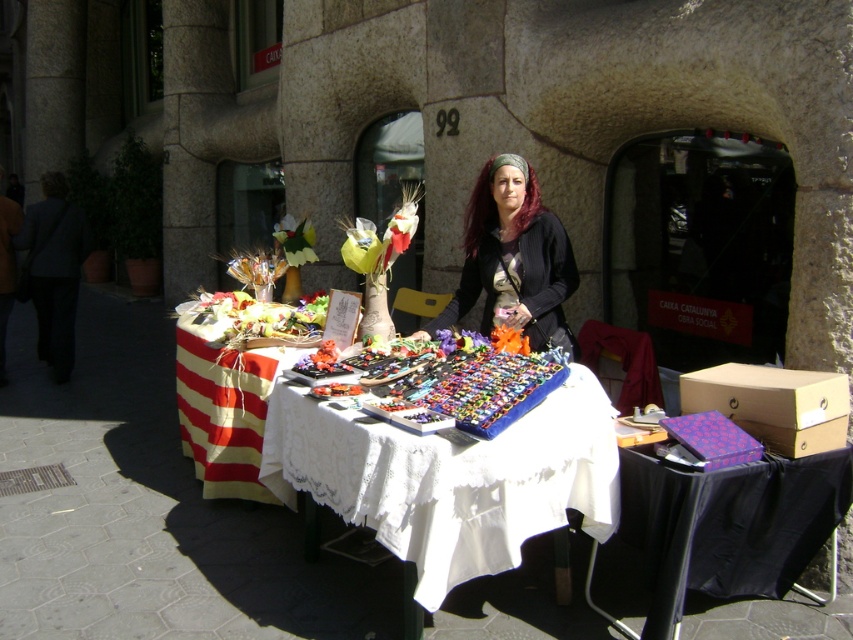
Is point (790, 486) behind point (544, 332)?

No, (790, 486) is closer to viewer.

Does purple fabric box at lower right have a greater height compared to matte black jacket at center?

In fact, purple fabric box at lower right may be shorter than matte black jacket at center.

Is point (674, 492) closer to viewer compared to point (508, 324)?

Yes, point (674, 492) is closer to viewer.

You are a GUI agent. You are given a task and a screenshot of the screen. Output one action in this format:
    pyautogui.click(x=<x>, y=<y>)
    Task: Click on the purple fabric box at lower right
    
    Given the screenshot: What is the action you would take?
    pyautogui.click(x=726, y=528)

Is purple fabric box at lower right to the left of purple fabric flower at center from the viewer's perspective?

Incorrect, purple fabric box at lower right is not on the left side of purple fabric flower at center.

In the scene shown: Is purple fabric box at lower right further to camera compared to purple fabric flower at center?

That is False.

Who is more forward, (753, 547) or (497, 348)?

Point (753, 547)

Locate an element on the screen. The image size is (853, 640). purple fabric box at lower right is located at coordinates (726, 528).

Can you confirm if purple fabric box at lower right is bigger than red striped fabric at lower left?

Incorrect, purple fabric box at lower right is not larger than red striped fabric at lower left.

Can you confirm if purple fabric box at lower right is positioned to the right of red striped fabric at lower left?

Yes, purple fabric box at lower right is to the right of red striped fabric at lower left.

Is point (811, 493) more distant than point (245, 499)?

No, (811, 493) is in front of (245, 499).

You are a GUI agent. You are given a task and a screenshot of the screen. Output one action in this format:
    pyautogui.click(x=<x>, y=<y>)
    Task: Click on the purple fabric box at lower right
    The width and height of the screenshot is (853, 640).
    Given the screenshot: What is the action you would take?
    pyautogui.click(x=726, y=528)